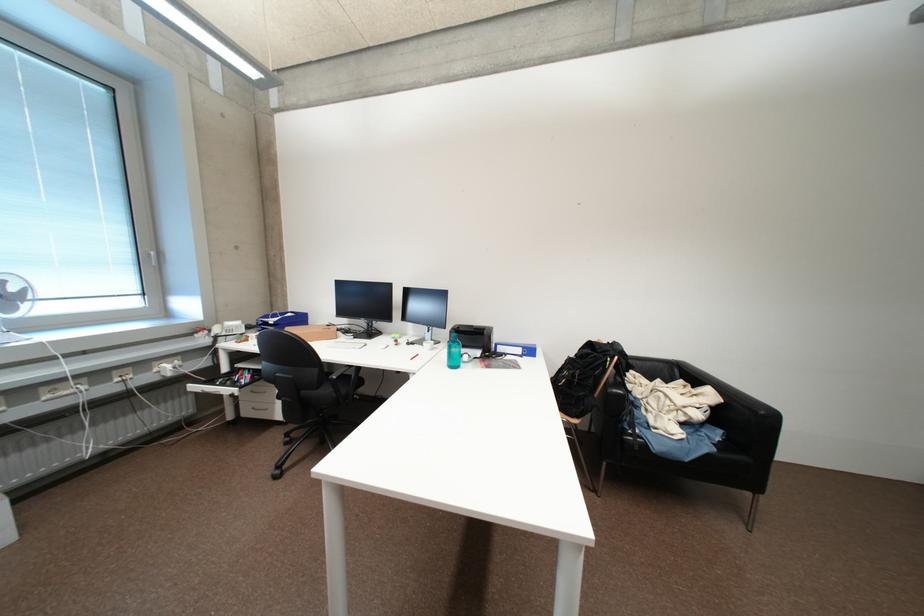
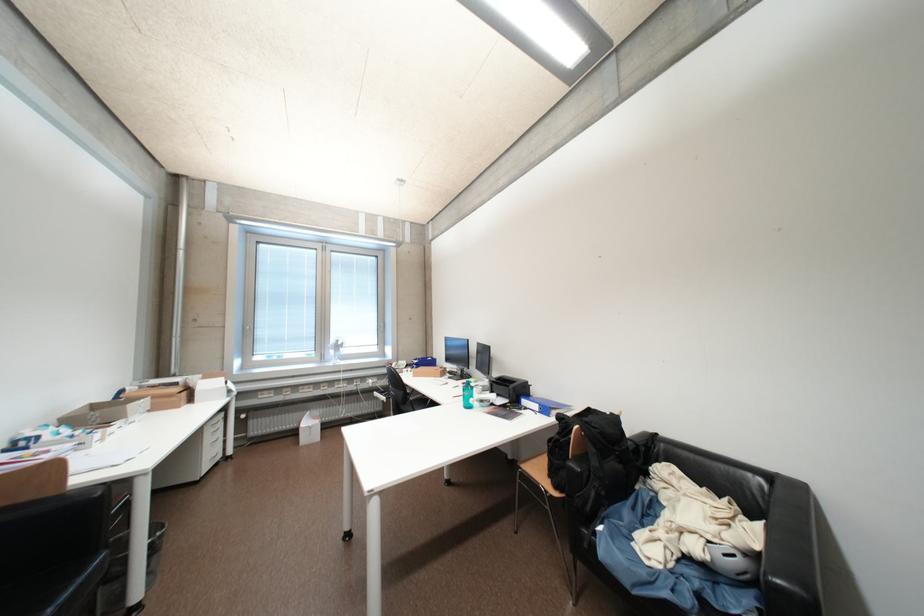
The point at (706, 416) is marked in the first image. Where is the corresponding point in the second image?

(704, 551)